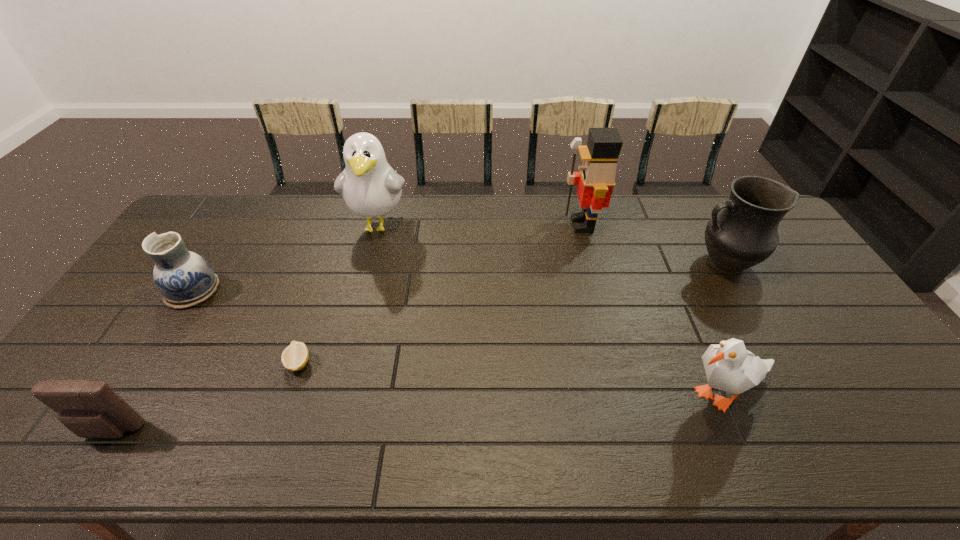
You are a GUI agent. You are given a task and a screenshot of the screen. Output one action in this format:
    pyautogui.click(x=<x>, y=<y>)
    Task: Click on the vacant space situated on the back of the lemon
    The height and width of the screenshot is (540, 960).
    Given the screenshot: What is the action you would take?
    pyautogui.click(x=309, y=331)

Locate an element on the screen. gull at the far edge is located at coordinates (371, 188).

Identify the location of nutcracker at the far edge. The image size is (960, 540). (596, 179).

Find the location of a particular element. object that is at the near edge is located at coordinates (90, 409).

Locate an element on the screen. This screenshot has height=540, width=960. pottery that is positioned at the left edge is located at coordinates (185, 279).

At what (x,y) coordinates should I click in order to perform the action: click on pouch present at the left edge. Please return your answer as a coordinate pair (x, y). The width and height of the screenshot is (960, 540). Looking at the image, I should click on (90, 409).

This screenshot has width=960, height=540. Find the location of `object that is at the right edge`. object that is at the right edge is located at coordinates (744, 234).

The height and width of the screenshot is (540, 960). Identify the location of object located in the near left corner section of the desktop. (90, 409).

Where is `vacant space at the far edge of the desktop`? vacant space at the far edge of the desktop is located at coordinates (666, 200).

Where is `vacant space at the near edge`? vacant space at the near edge is located at coordinates (709, 441).